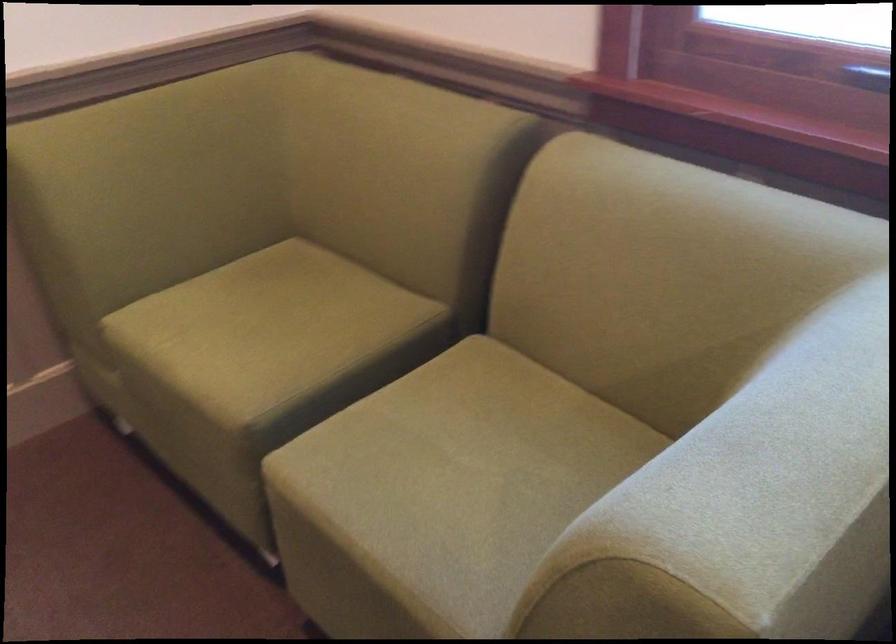
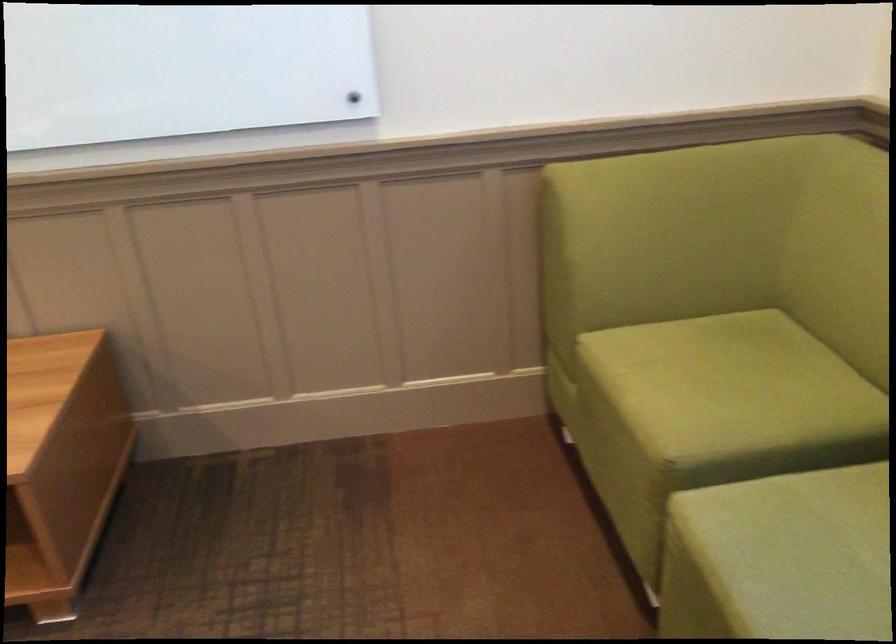
Question: The camera is either moving clockwise (left) or counter-clockwise (right) around the object. The first image is from the beginning of the video and the second image is from the end. Is the camera moving left or right when shooting the video?

Choices:
 (A) Left
 (B) Right

Answer: (B)